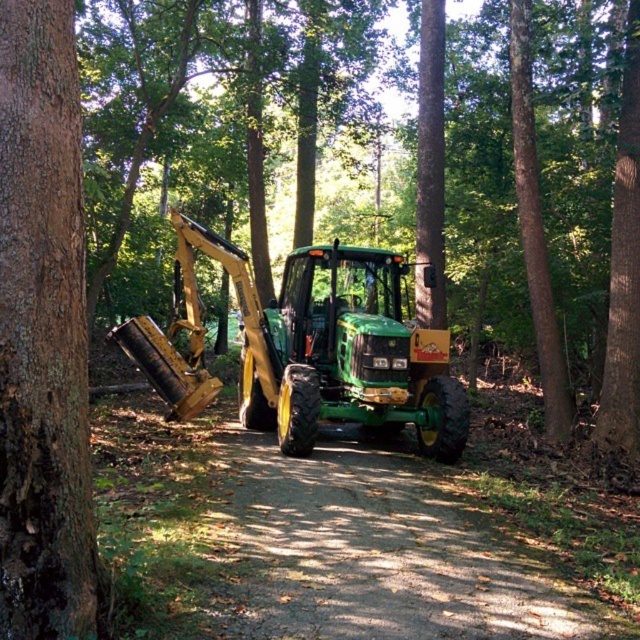
Who is positioned more to the left, brown rough bark tree at center-left or green matte tractor at center?

Positioned to the left is brown rough bark tree at center-left.

Is brown rough bark tree at center-left positioned behind green matte tractor at center?

No, brown rough bark tree at center-left is in front of green matte tractor at center.

Is point (10, 550) positioned behind point (173, 364)?

No, (10, 550) is closer to viewer.

Where is `brown rough bark tree at center-left`? brown rough bark tree at center-left is located at coordinates (44, 337).